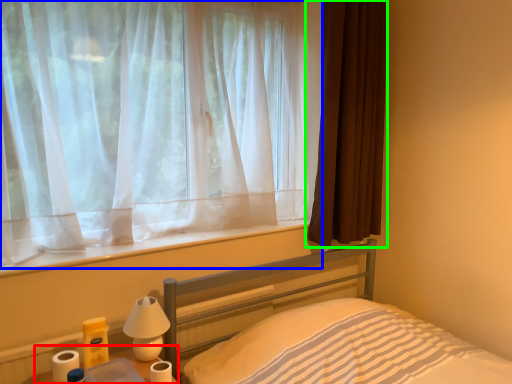
Question: Which object is positioned closest to table (highlighted by a red box)? Select from curtain (highlighted by a blue box) and curtain (highlighted by a green box).

Choices:
 (A) curtain
 (B) curtain

Answer: (A)